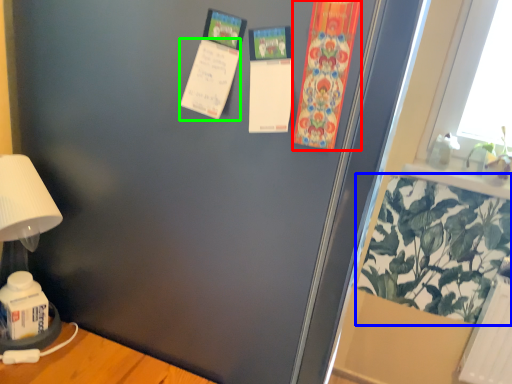
Question: Which object is the farthest from postcard (highlighted by a red box)? Choose among these: plant (highlighted by a blue box) or postcard (highlighted by a green box).

Choices:
 (A) plant
 (B) postcard

Answer: (A)